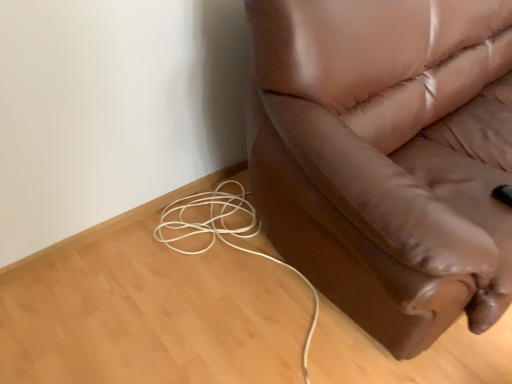
Describe the element at coordinates (388, 157) in the screenshot. This screenshot has height=384, width=512. I see `brown leather couch at lower right` at that location.

Locate an element on the screen. brown leather couch at lower right is located at coordinates (x=388, y=157).

Where is `brown leather couch at lower right`? brown leather couch at lower right is located at coordinates (388, 157).